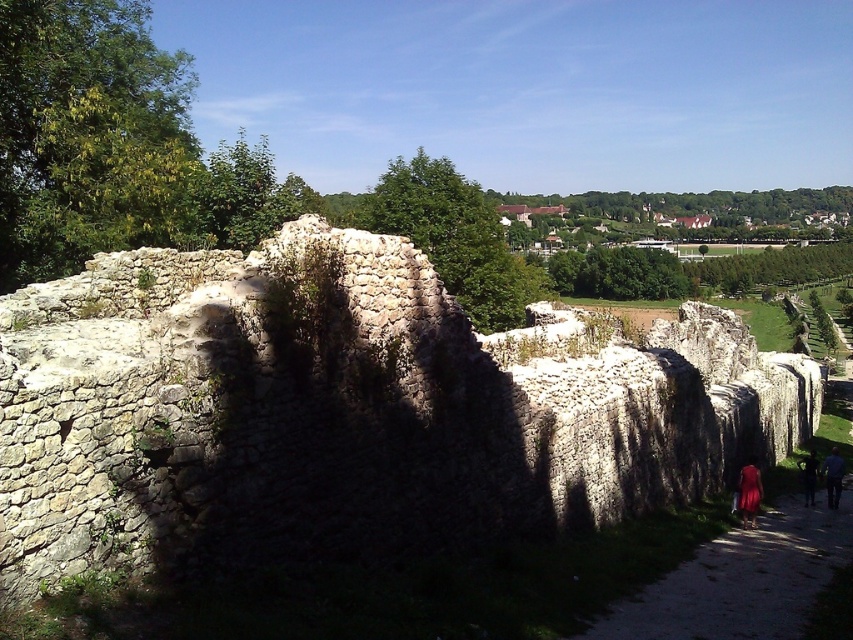
You are standing at the base of the historical stone wall structure and want to find the dirt path at lower right. According to the coordinates provided, where should you look relative to the wall?

The dirt path at lower right is located at coordinates point (741, 579), which is towards the lower right direction from the wall.

You are standing on the dirt path at lower right and want to walk towards the dark blue jeans at lower right. Which direction should you move to reach them?

The dirt path at lower right is in front of the dark blue jeans at lower right, so you should move backward to reach the dark blue jeans at lower right.

You are standing at the base of the historical stone wall and see both the dirt path at lower right and the matte red dress at lower right. Which object is closer to you?

The dirt path at lower right is 24.37 feet away from the matte red dress at lower right, so the distance between them is 24.37 feet. However, the question asks which is closer to you. Since both are at the lower right, but the description only provides their separation distance, not their individual distances from the observer, we cannot determine which is closer based on the given information.